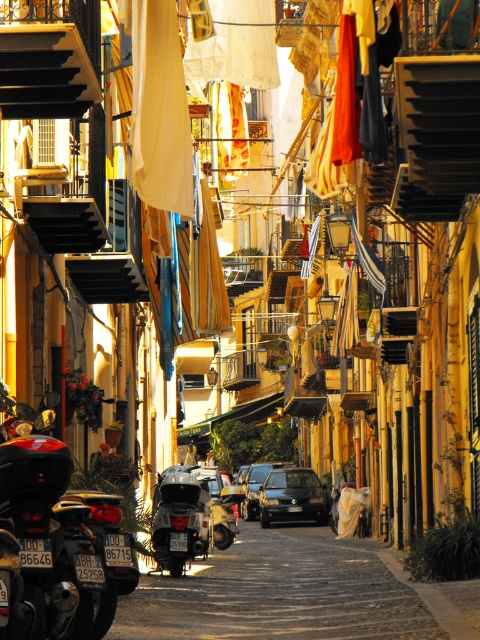
Question: Which object is positioned farthest from the shiny metallic scooter at center?

Choices:
 (A) shiny dark blue sedan at center
 (B) shiny blue sedan at center

Answer: (B)

Question: Is shiny metallic scooter at center above shiny blue sedan at center?

Choices:
 (A) yes
 (B) no

Answer: (A)

Question: Is shiny dark blue sedan at center below shiny blue sedan at center?

Choices:
 (A) yes
 (B) no

Answer: (B)

Question: Which point appears farthest from the camera in this image?

Choices:
 (A) (154, 532)
 (B) (295, 484)

Answer: (B)

Question: Is shiny metallic scooter at center thinner than shiny blue sedan at center?

Choices:
 (A) yes
 (B) no

Answer: (A)

Question: Among these points, which one is farthest from the camera?

Choices:
 (A) (301, 506)
 (B) (179, 550)
 (C) (252, 468)

Answer: (C)